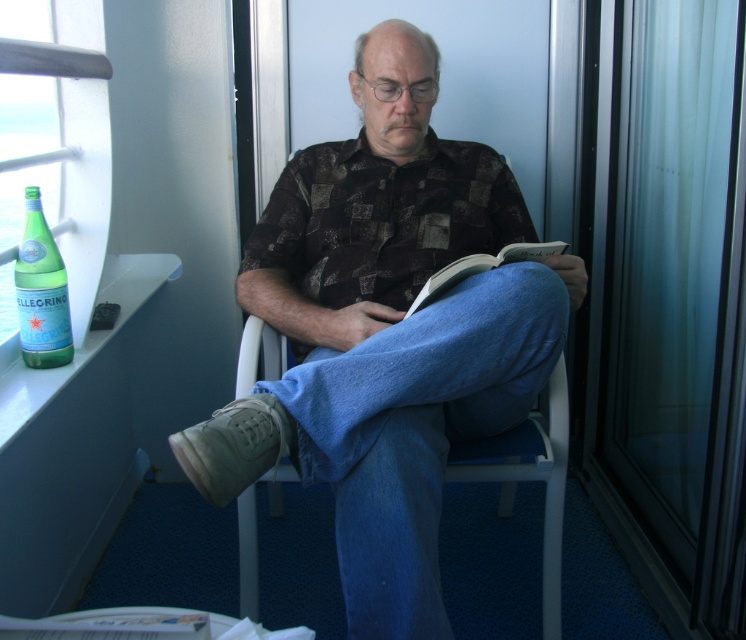
From the picture: You are organizing items on a shelf and need to place the green glass bottle at left and the white paper book at lower left side by side. Which item requires more horizontal space?

The white paper book at lower left requires more horizontal space because its width is greater than the green glass bottle at left.

You are a photographer trying to capture the matte brown shirt at center and the green glass bottle at left in the same frame. Based on their positions, which object would appear closer to the bottom of the photo?

The matte brown shirt at center is positioned under the green glass bottle at left, so it would appear closer to the bottom of the photo.

You are a photographer trying to capture the scene with the matte brown shirt at center and the green glass bottle at left. Based on their positions, which object is closer to the left side of the frame?

The green glass bottle at left is closer to the left side of the frame because the matte brown shirt at center is positioned on the right side of it.